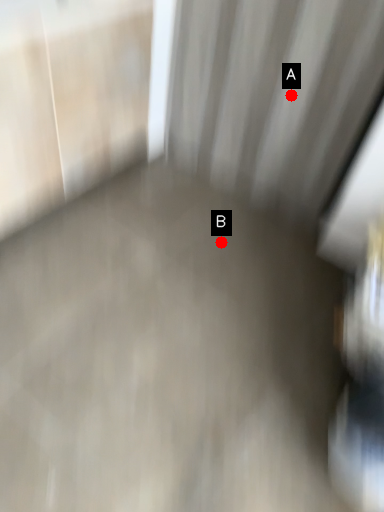
Question: Two points are circled on the image, labeled by A and B beside each circle. Which of the following is the closest to the observer?

Choices:
 (A) A is closer
 (B) B is closer

Answer: (A)